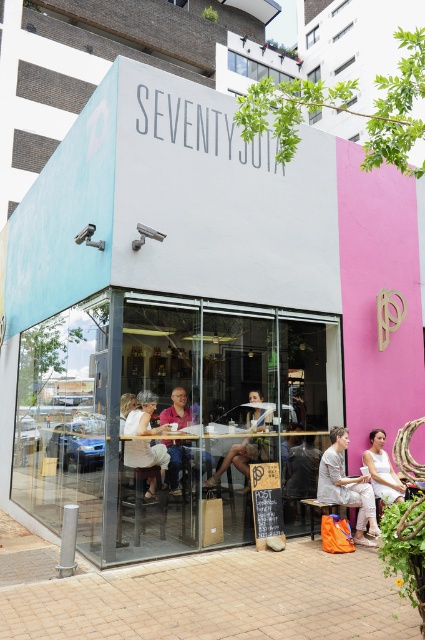
Question: Is wooden table at center further to the viewer compared to pink fabric shirt at center?

Choices:
 (A) yes
 (B) no

Answer: (B)

Question: Is wooden table at center behind white cotton dress at lower right?

Choices:
 (A) yes
 (B) no

Answer: (B)

Question: Which point is closer to the camera?

Choices:
 (A) white cotton dress at center
 (B) wooden table at center
 (C) pink fabric shirt at center
 (D) white fabric dress at lower right

Answer: (A)

Question: Does matte black laptop at center appear over white fabric dress at lower right?

Choices:
 (A) no
 (B) yes

Answer: (B)

Question: Which point is closer to the camera?

Choices:
 (A) white cotton dress at center
 (B) wooden table at center
 (C) matte black laptop at center

Answer: (A)

Question: Which object appears closest to the camera in this image?

Choices:
 (A) white cotton dress at center
 (B) white cotton dress at lower right
 (C) wooden table at center

Answer: (A)